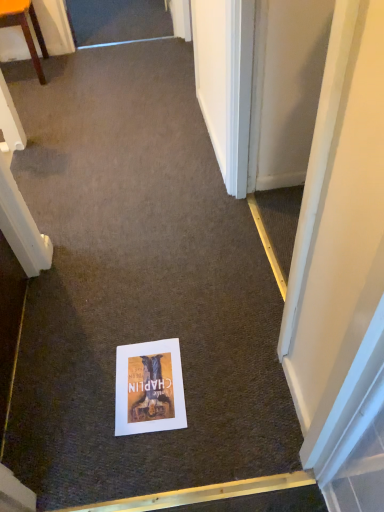
Image resolution: width=384 pixels, height=512 pixels. What are the coordinates of `free space to the back side of matte paper poster at center` in the screenshot? It's located at (148, 322).